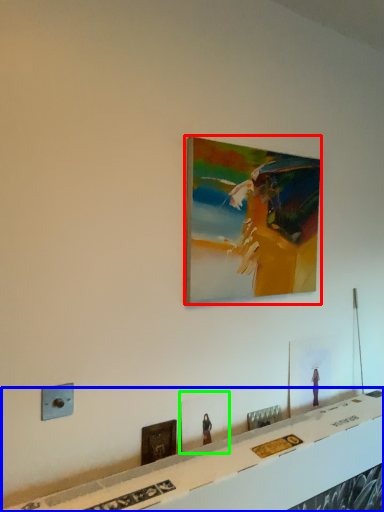
Question: Which is nearer to the picture frame (highlighted by a red box)? table (highlighted by a blue box) or picture frame (highlighted by a green box).

Choices:
 (A) table
 (B) picture frame

Answer: (B)